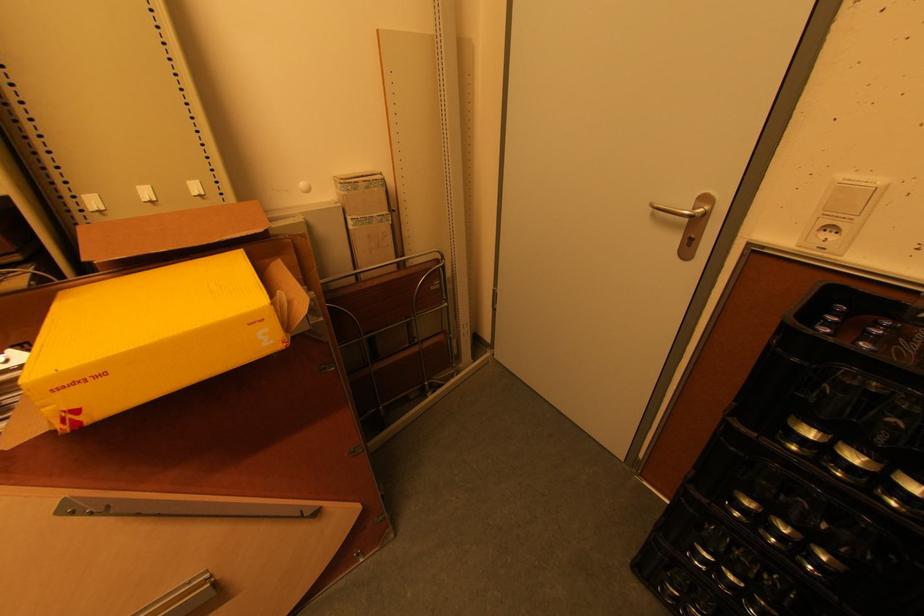
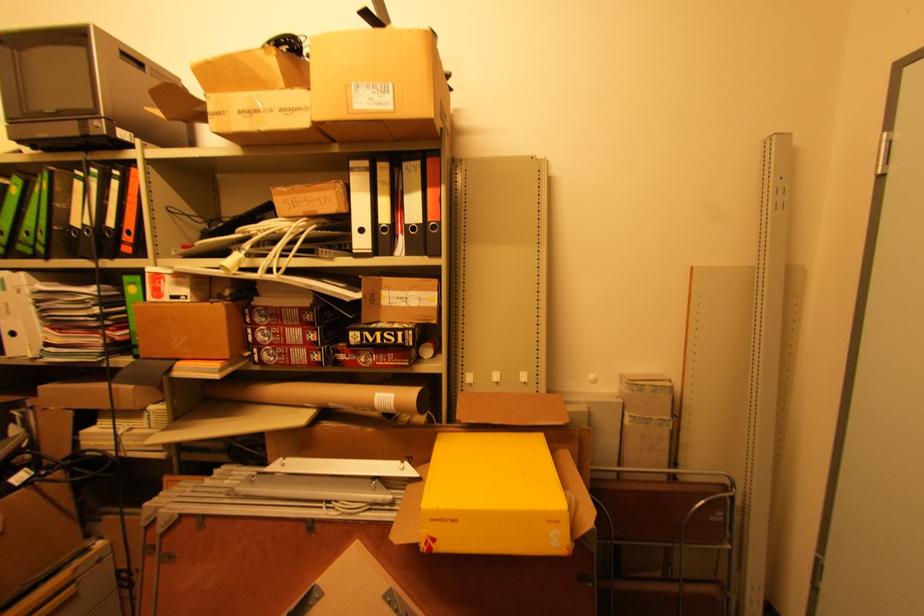
First-person continuous shooting, in which direction is the camera rotating?

The rotation direction of the camera is left-up.